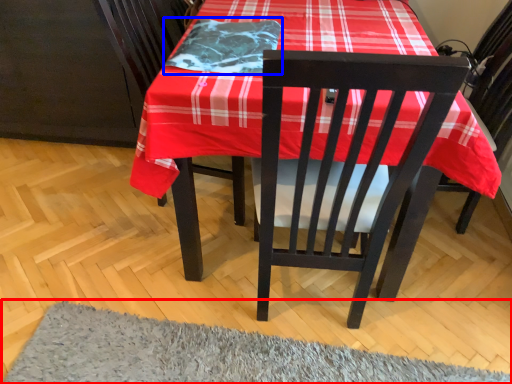
Question: Which object is further to the camera taking this photo, mat (highlighted by a red box) or blanket (highlighted by a blue box)?

Choices:
 (A) mat
 (B) blanket

Answer: (B)